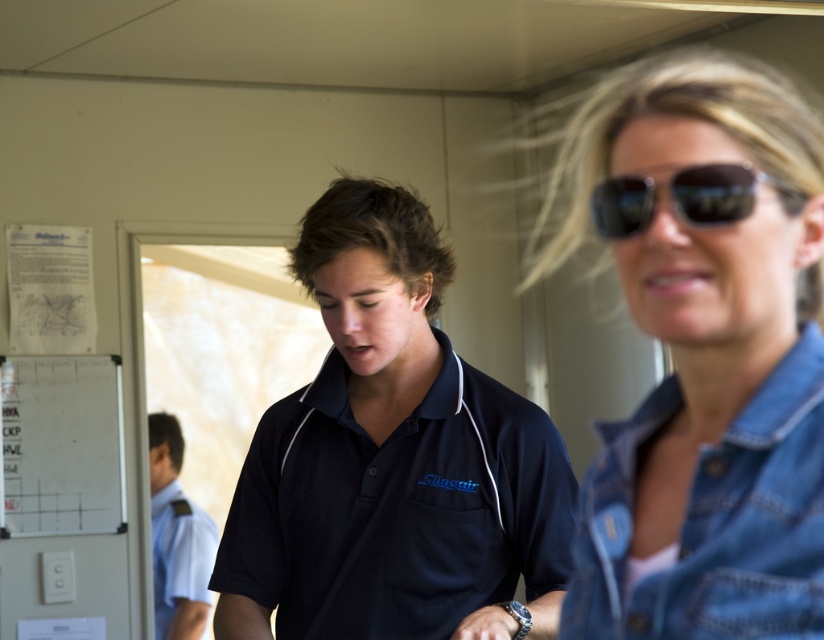
Looking at this image, which is more to the left, light blue uniform at lower left or black reflective sunglasses at upper right?

From the viewer's perspective, light blue uniform at lower left appears more on the left side.

Can you confirm if light blue uniform at lower left is positioned above black reflective sunglasses at upper right?

Actually, light blue uniform at lower left is below black reflective sunglasses at upper right.

Which is in front, point (172, 481) or point (607, 182)?

Positioned in front is point (607, 182).

At what (x,y) coordinates should I click in order to perform the action: click on light blue uniform at lower left. Please return your answer as a coordinate pair (x, y). Looking at the image, I should click on pos(176,540).

Which of these two, denim jacket at upper right or light blue uniform at lower left, stands shorter?

Standing shorter between the two is denim jacket at upper right.

Is denim jacket at upper right positioned in front of light blue uniform at lower left?

Yes.

Describe the element at coordinates (705, 349) in the screenshot. The height and width of the screenshot is (640, 824). I see `denim jacket at upper right` at that location.

At what (x,y) coordinates should I click in order to perform the action: click on denim jacket at upper right. Please return your answer as a coordinate pair (x, y). Looking at the image, I should click on [x=705, y=349].

Can you confirm if denim jacket at lower right is positioned above black reflective sunglasses at upper right?

Incorrect, denim jacket at lower right is not positioned above black reflective sunglasses at upper right.

The width and height of the screenshot is (824, 640). What are the coordinates of `denim jacket at lower right` in the screenshot? It's located at coord(714,518).